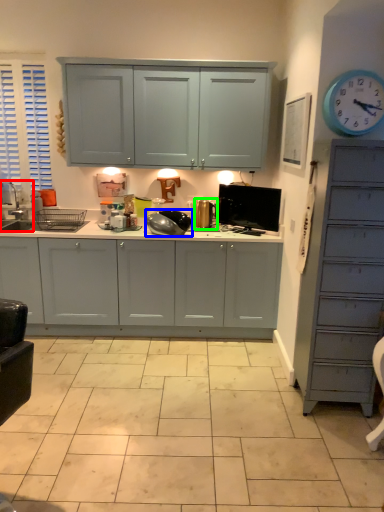
Question: Which is farther away from sink (highlighted by a red box)? appliance (highlighted by a blue box) or appliance (highlighted by a green box)?

Choices:
 (A) appliance
 (B) appliance

Answer: (B)